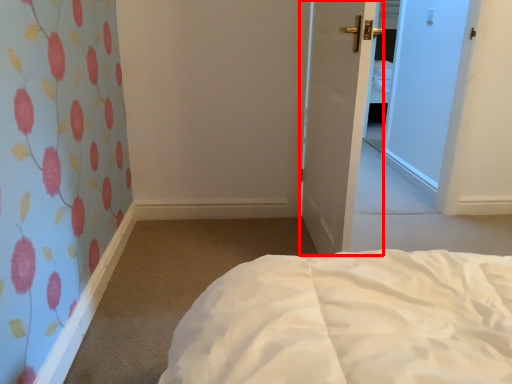
Question: Considering the relative positions of door (annotated by the red box) and bed in the image provided, where is door (annotated by the red box) located with respect to the staircase?

Choices:
 (A) right
 (B) left

Answer: (B)